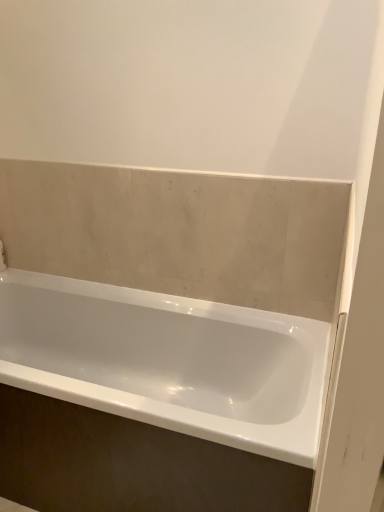
Find the location of a particular element. This screenshot has height=512, width=384. white glossy bathtub at center is located at coordinates (168, 361).

What do you see at coordinates (168, 361) in the screenshot? I see `white glossy bathtub at center` at bounding box center [168, 361].

Find the location of `white glossy bathtub at center`. white glossy bathtub at center is located at coordinates (168, 361).